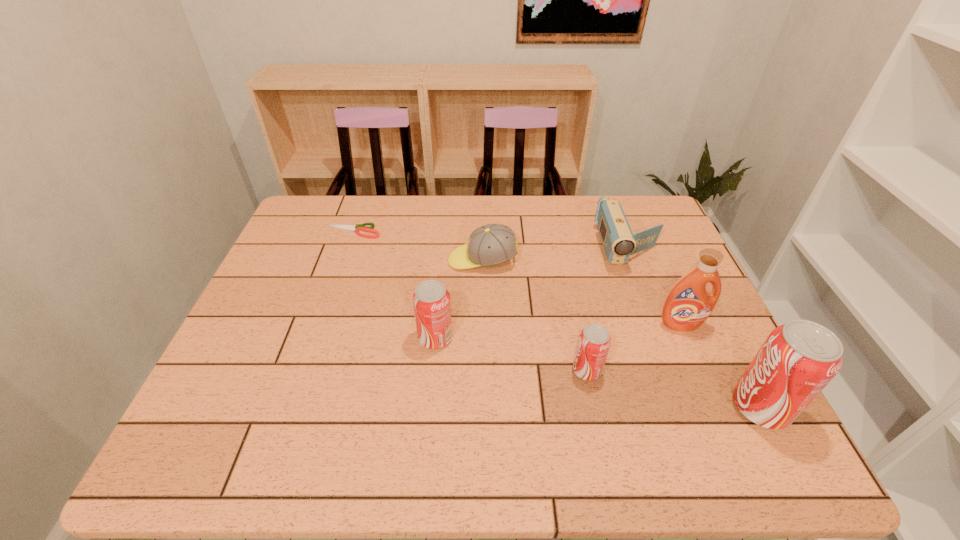
Find the location of a particular element. This screenshot has width=960, height=540. camcorder that is at the right edge is located at coordinates (619, 243).

Find the location of a particular element. The image size is (960, 540). detergent that is at the right edge is located at coordinates (688, 304).

The height and width of the screenshot is (540, 960). Find the location of `object at the far left corner`. object at the far left corner is located at coordinates (359, 227).

The image size is (960, 540). I want to click on object situated at the far right corner, so click(619, 243).

Locate an element on the screen. This screenshot has width=960, height=540. object positioned at the near right corner is located at coordinates (798, 359).

In the image, there is a desktop. Identify the location of vacant space at the far edge. [x=573, y=209].

This screenshot has height=540, width=960. In order to click on blank space at the near edge in this screenshot , I will do `click(442, 411)`.

Find the location of a particular element. The height and width of the screenshot is (540, 960). vacant space at the left edge is located at coordinates (315, 244).

Identify the location of vacant space at the far left corner of the desktop. (341, 213).

Locate an element on the screen. blank space at the near left corner of the desktop is located at coordinates (265, 408).